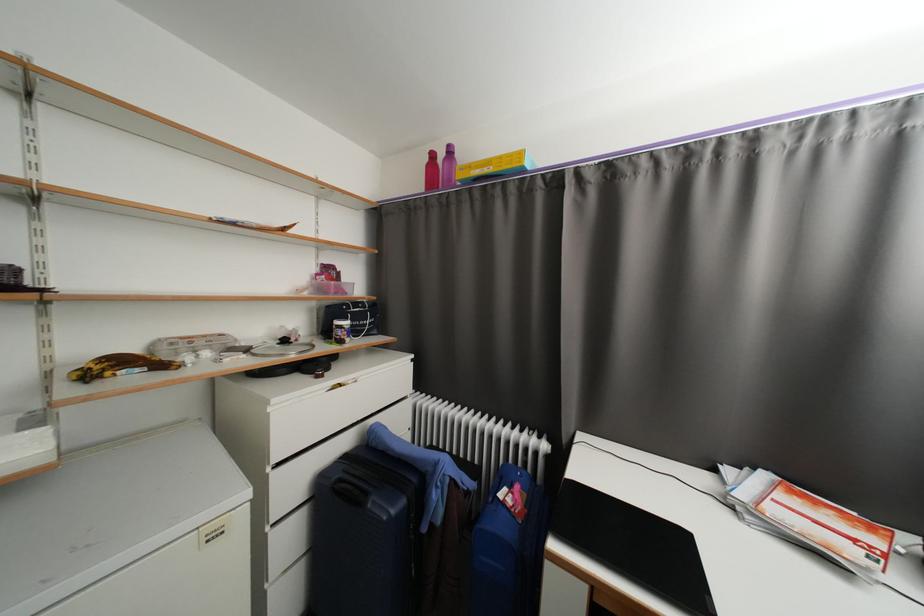
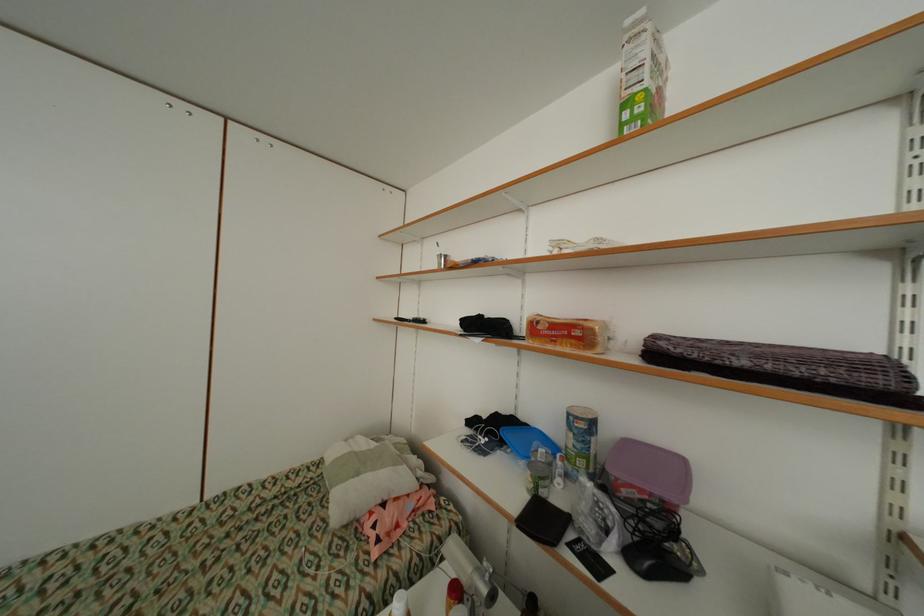
Question: The camera is either moving clockwise (left) or counter-clockwise (right) around the object. The first image is from the beginning of the video and the second image is from the end. Is the camera moving left or right when shooting the video?

Choices:
 (A) Left
 (B) Right

Answer: (B)